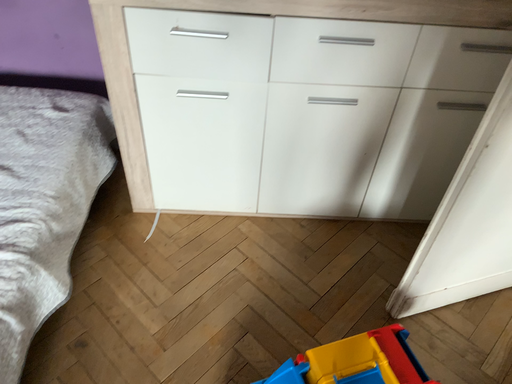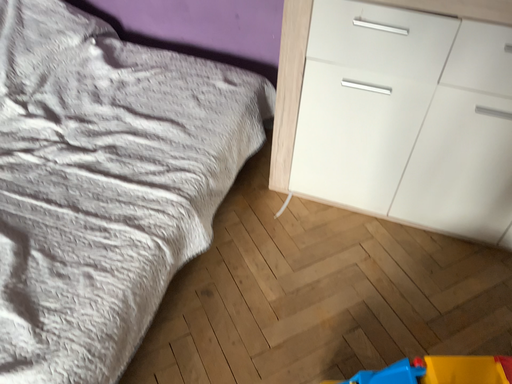
Question: How did the camera likely rotate when shooting the video?

Choices:
 (A) rotated right
 (B) rotated left

Answer: (B)